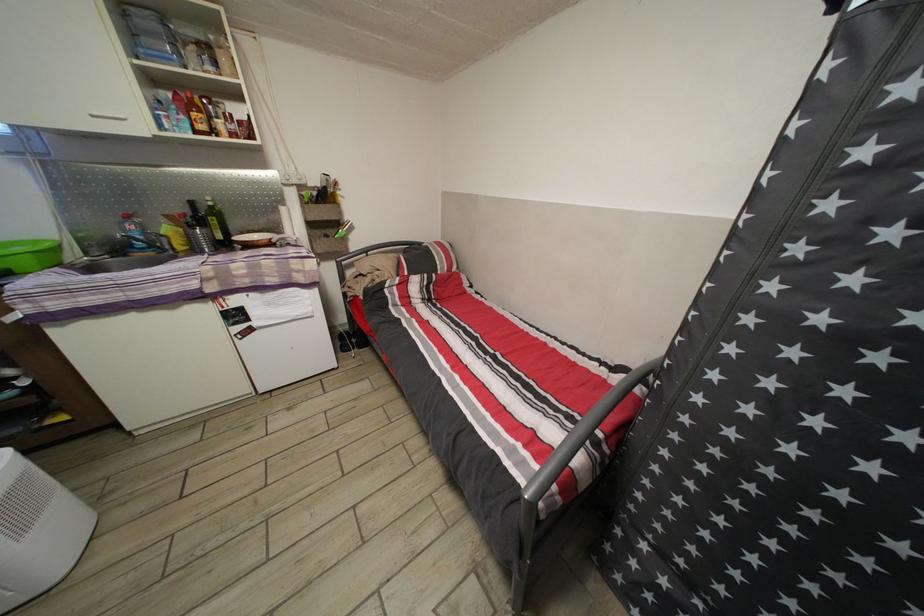
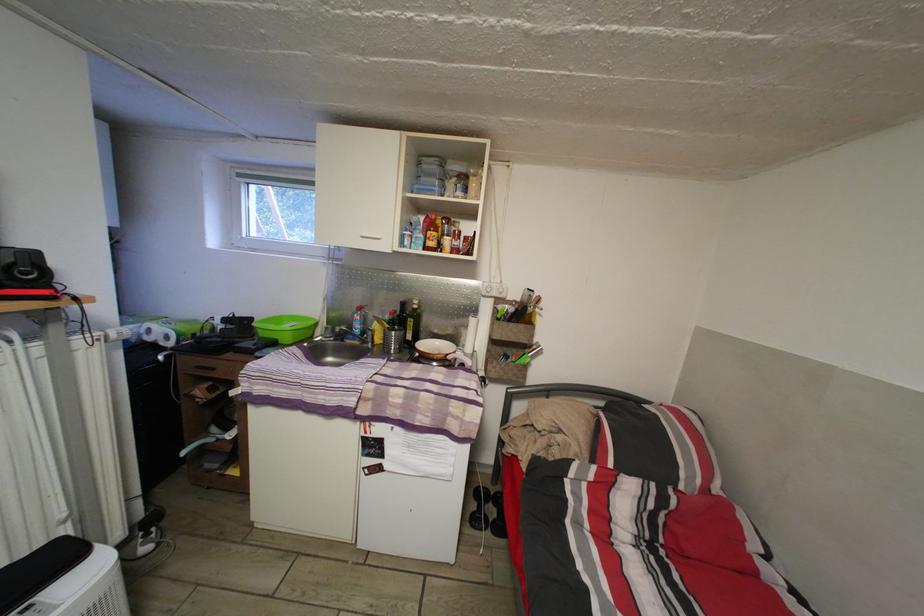
Find the pixel in the second image that matches point 226,243 in the first image.

(417, 344)